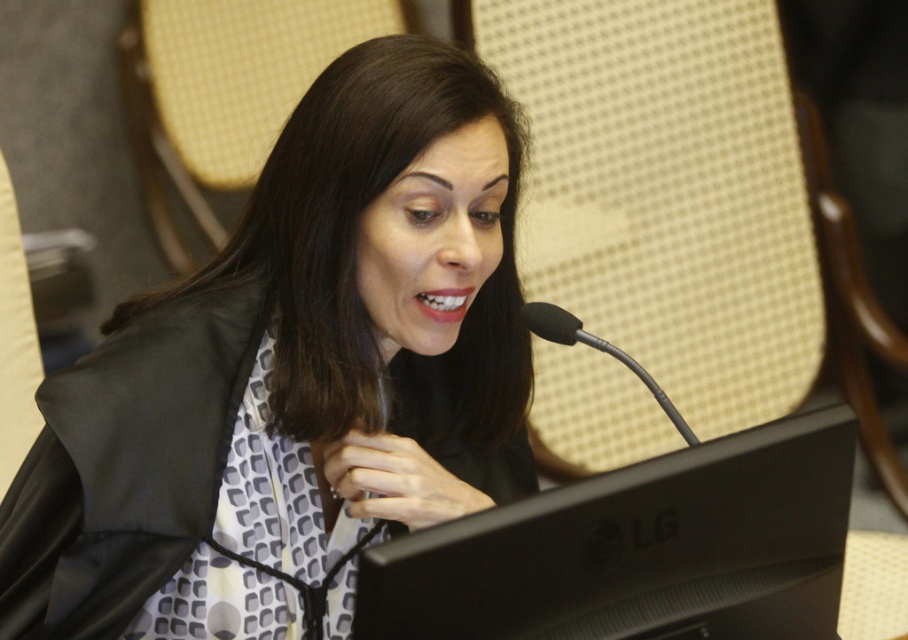
Is black matte jacket at center to the left of black matte computer screen at center from the viewer's perspective?

Yes, black matte jacket at center is to the left of black matte computer screen at center.

Which of these two, black matte jacket at center or black matte computer screen at center, stands shorter?

black matte computer screen at center is shorter.

Does point (114, 616) come in front of point (607, 611)?

No, it is behind (607, 611).

Where is `black matte jacket at center`? The height and width of the screenshot is (640, 908). black matte jacket at center is located at coordinates (294, 378).

Is black matte computer screen at center below black metallic microphone at center?

Yes, black matte computer screen at center is below black metallic microphone at center.

Between point (475, 529) and point (638, 372), which one is positioned behind?

The point (638, 372) is more distant.

Does point (835, 611) come in front of point (546, 337)?

Yes, it is.

Image resolution: width=908 pixels, height=640 pixels. Find the location of `black matte computer screen at center`. black matte computer screen at center is located at coordinates (638, 548).

Is point (455, 227) in front of point (660, 392)?

Yes, it is in front of point (660, 392).

Is black matte jacket at center positioned at the back of black metallic microphone at center?

Yes, black matte jacket at center is behind black metallic microphone at center.

Locate an element on the screen. Image resolution: width=908 pixels, height=640 pixels. black matte jacket at center is located at coordinates (294, 378).

In order to click on black matte jacket at center in this screenshot , I will do `click(294, 378)`.